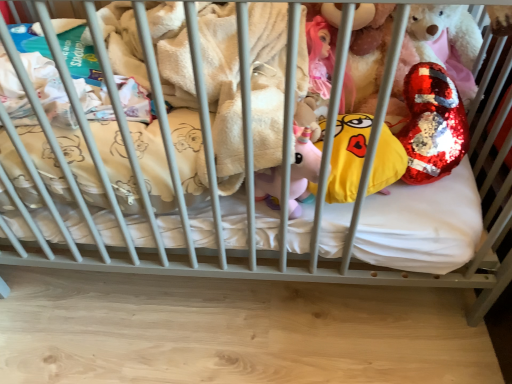
Where is `shiny sequined heart at upper right`? shiny sequined heart at upper right is located at coordinates (432, 124).

Would you consider white soft mattress at center to be distant from shiny sequined heart at upper right?

No.

Which point is more distant from viewer, (309, 214) or (455, 111)?

Positioned behind is point (455, 111).

Does white soft mattress at center have a lesser height compared to shiny sequined heart at upper right?

Yes.

Which object is positioned more to the left, white soft mattress at center or shiny sequined heart at upper right?

white soft mattress at center.

How different are the orientations of yellow sequined pillow at center and white soft mattress at center in degrees?

There is a 3.19-degree angle between the facing directions of yellow sequined pillow at center and white soft mattress at center.

From the image's perspective, is yellow sequined pillow at center beneath white soft mattress at center?

Yes, from the image's perspective, yellow sequined pillow at center is below white soft mattress at center.

Is white soft mattress at center at the back of yellow sequined pillow at center?

No, yellow sequined pillow at center is not facing away from white soft mattress at center.

Consider the image. Does yellow sequined pillow at center lie behind white soft mattress at center?

No.

From a real-world perspective, does shiny sequined heart at upper right sit lower than white soft mattress at center?

No, from a real-world perspective, shiny sequined heart at upper right is not beneath white soft mattress at center.

Considering the positions of objects shiny sequined heart at upper right and white soft mattress at center in the image provided, who is more to the left, shiny sequined heart at upper right or white soft mattress at center?

From the viewer's perspective, white soft mattress at center appears more on the left side.

Are shiny sequined heart at upper right and white soft mattress at center making contact?

They are not placed beside each other.

Based on their sizes in the image, would you say shiny sequined heart at upper right is bigger or smaller than yellow sequined pillow at center?

shiny sequined heart at upper right is bigger than yellow sequined pillow at center.

Is point (440, 131) in front of point (334, 143)?

No.

Could you tell me if shiny sequined heart at upper right is facing yellow sequined pillow at center?

No, shiny sequined heart at upper right is not aimed at yellow sequined pillow at center.

Can you confirm if shiny sequined heart at upper right is positioned to the right of yellow sequined pillow at center?

Correct, you'll find shiny sequined heart at upper right to the right of yellow sequined pillow at center.

Is yellow sequined pillow at center inside or outside of shiny sequined heart at upper right?

yellow sequined pillow at center is located beyond the bounds of shiny sequined heart at upper right.

Is yellow sequined pillow at center far away from shiny sequined heart at upper right?

They are positioned close to each other.

Where is `toy on the right side of yellow sequined pillow at center`? The height and width of the screenshot is (384, 512). toy on the right side of yellow sequined pillow at center is located at coordinates (432, 124).

Between yellow sequined pillow at center and shiny sequined heart at upper right, which one has smaller size?

With smaller size is yellow sequined pillow at center.

At what (x,y) coordinates should I click in order to perform the action: click on pillow in front of the white soft mattress at center. Please return your answer as a coordinate pair (x, y). This screenshot has width=512, height=384. Looking at the image, I should click on (348, 156).

Is white soft mattress at center facing towards yellow sequined pillow at center?

No, white soft mattress at center is not aimed at yellow sequined pillow at center.

Considering the sizes of objects white soft mattress at center and yellow sequined pillow at center in the image provided, who is taller, white soft mattress at center or yellow sequined pillow at center?

yellow sequined pillow at center.

How different are the orientations of white soft mattress at center and yellow sequined pillow at center in degrees?

3.19 degrees.

In order to click on mattress on the left side of shiny sequined heart at upper right in this screenshot , I will do `click(422, 225)`.

You are a GUI agent. You are given a task and a screenshot of the screen. Output one action in this format:
    pyautogui.click(x=<x>, y=<y>)
    Task: Click on the mattress above the yellow sequined pillow at center (from the image's perspective)
    This screenshot has height=384, width=512.
    Given the screenshot: What is the action you would take?
    pyautogui.click(x=422, y=225)

Which object lies further to the anchor point shiny sequined heart at upper right, yellow sequined pillow at center or white soft mattress at center?

white soft mattress at center is positioned further to the anchor shiny sequined heart at upper right.

Consider the image. Considering their positions, is shiny sequined heart at upper right positioned closer to yellow sequined pillow at center than white soft mattress at center?

Among the two, shiny sequined heart at upper right is located nearer to yellow sequined pillow at center.

Based on their spatial positions, is white soft mattress at center or yellow sequined pillow at center closer to shiny sequined heart at upper right?

Based on the image, yellow sequined pillow at center appears to be nearer to shiny sequined heart at upper right.

Considering their positions, is yellow sequined pillow at center positioned further to white soft mattress at center than shiny sequined heart at upper right?

shiny sequined heart at upper right is positioned further to the anchor white soft mattress at center.

Considering their positions, is white soft mattress at center positioned further to yellow sequined pillow at center than shiny sequined heart at upper right?

white soft mattress at center.

Which object lies nearer to the anchor point white soft mattress at center, shiny sequined heart at upper right or yellow sequined pillow at center?

The object closer to white soft mattress at center is yellow sequined pillow at center.

Where is `pillow between white soft mattress at center and shiny sequined heart at upper right in the horizontal direction`? This screenshot has width=512, height=384. pillow between white soft mattress at center and shiny sequined heart at upper right in the horizontal direction is located at coordinates (348, 156).